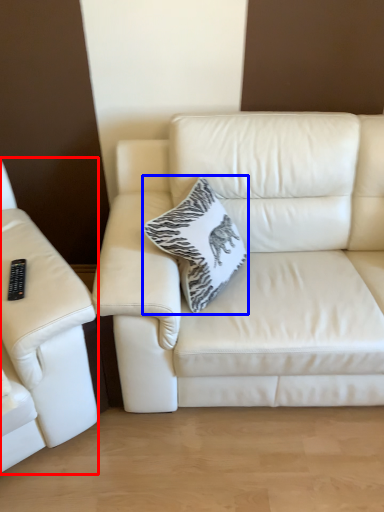
Question: Which point is further to the camera, studio couch (highlighted by a red box) or throw pillow (highlighted by a blue box)?

Choices:
 (A) studio couch
 (B) throw pillow

Answer: (B)